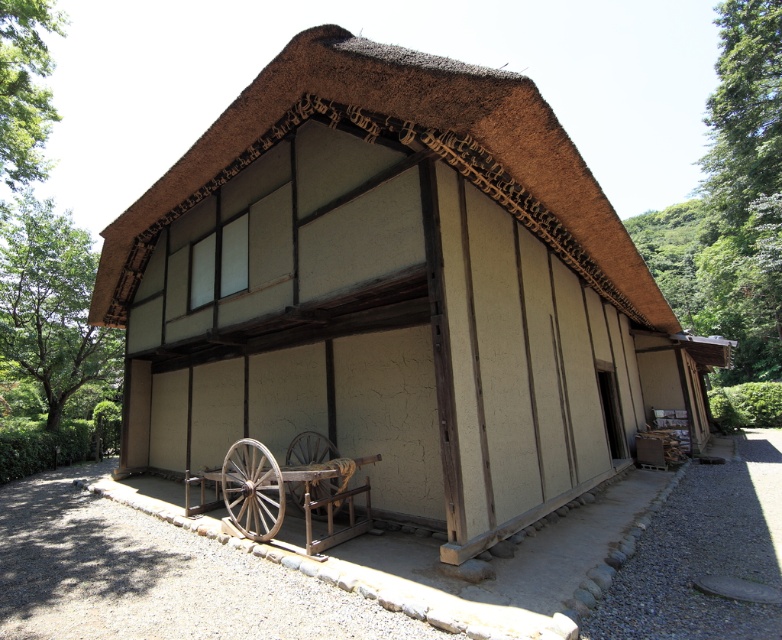
Image resolution: width=782 pixels, height=640 pixels. What do you see at coordinates (393, 291) in the screenshot? I see `beige stucco hut at center` at bounding box center [393, 291].

Is beige stucco hut at center shorter than wooden cart at center?

No.

Find the location of `beige stucco hut at center`. beige stucco hut at center is located at coordinates (393, 291).

Describe the element at coordinates (393, 291) in the screenshot. The image size is (782, 640). I see `beige stucco hut at center` at that location.

Who is more forward, (515, 173) or (232, 522)?

Positioned in front is point (515, 173).

This screenshot has width=782, height=640. Find the location of `beige stucco hut at center`. beige stucco hut at center is located at coordinates (393, 291).

Identify the location of beige stucco hut at center. (393, 291).

Does wooden cart at center appear under wooden at lower left?

Yes, wooden cart at center is below wooden at lower left.

Is wooden cart at center further to camera compared to wooden at lower left?

No, wooden cart at center is in front of wooden at lower left.

This screenshot has width=782, height=640. What do you see at coordinates (285, 490) in the screenshot? I see `wooden cart at center` at bounding box center [285, 490].

I want to click on wooden cart at center, so click(x=285, y=490).